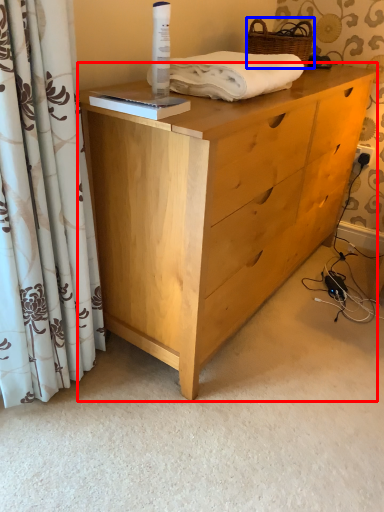
Question: Which of the following is the closest to the observer, chest of drawers (highlighted by a red box) or basket (highlighted by a blue box)?

Choices:
 (A) chest of drawers
 (B) basket

Answer: (A)